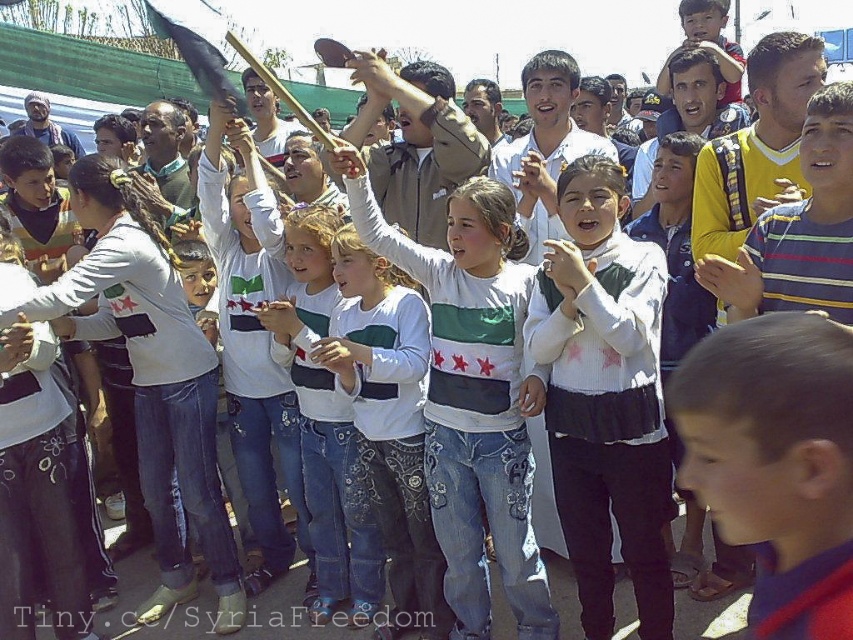
Question: Among these objects, which one is nearest to the camera?

Choices:
 (A) blue denim jeans at center
 (B) white knit sweater at center

Answer: (A)

Question: Is white knit sweater at center below white cotton shirt at center?

Choices:
 (A) no
 (B) yes

Answer: (B)

Question: Which object appears closest to the camera in this image?

Choices:
 (A) white cotton shirt at center
 (B) white knit sweater at center
 (C) white denim jeans at center

Answer: (B)

Question: Estimate the real-world distances between objects in this image. Which object is farther from the white denim jeans at center?

Choices:
 (A) blue denim jeans at center
 (B) white cotton shirt at center

Answer: (A)

Question: Does white cotton shirt at center lie behind white denim jeans at center?

Choices:
 (A) yes
 (B) no

Answer: (B)

Question: Can you confirm if white knit sweater at center is thinner than white denim jeans at center?

Choices:
 (A) no
 (B) yes

Answer: (B)